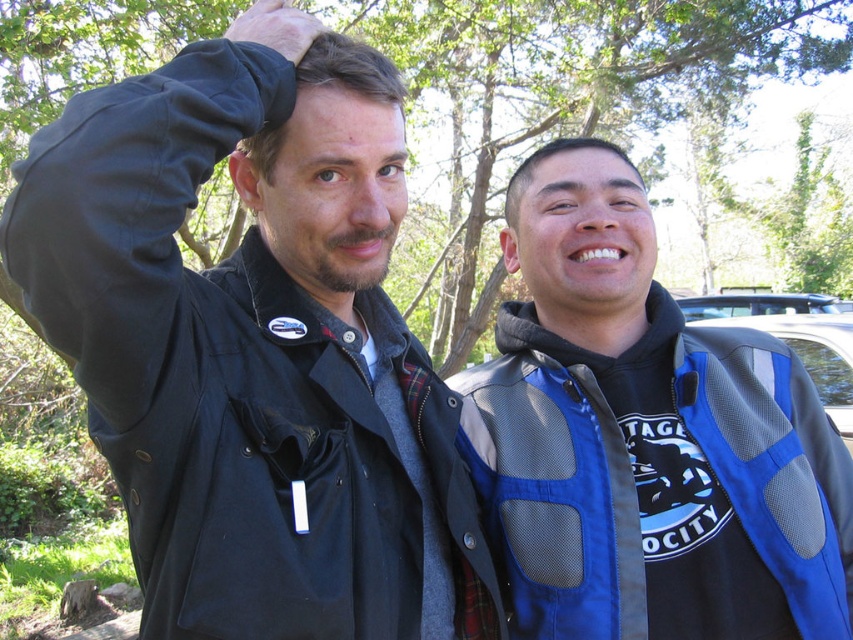
Is matte black jacket at left in front of blue mesh jacket at right?

That is True.

Between point (222, 540) and point (624, 384), which one is positioned in front?

Point (222, 540)

Image resolution: width=853 pixels, height=640 pixels. I want to click on matte black jacket at left, so click(x=256, y=344).